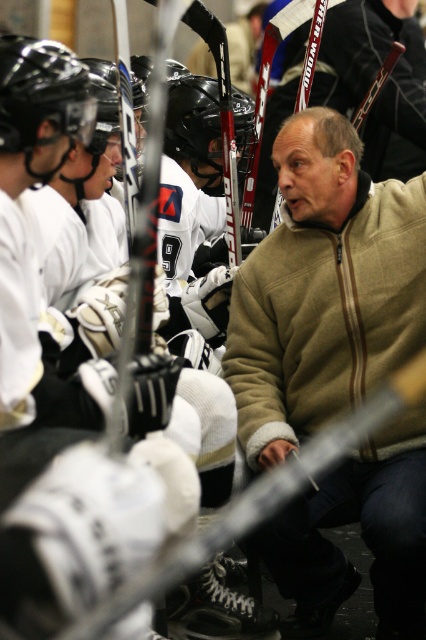
You are a photographer trying to capture a closeup of the black matte helmet at left and the black matte helmet at center. Based on their sizes in the image, which helmet would require you to move closer to get a clear shot?

The black matte helmet at left occupies less space than the black matte helmet at center, so to capture a clear closeup of the smaller helmet, you would need to move closer to it.

You are a photographer standing at the edge of the hockey rink. You notice a specific point marked at coordinates point (324, 289). Based on the scene, where is this point located?

The point (324, 289) is located on the beige fleece jacket at center.